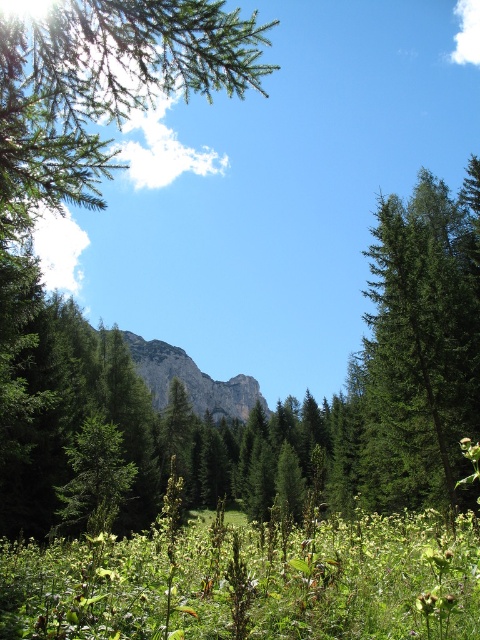
Does green needle-like branches at upper left appear under green matte tree at right?

Incorrect, green needle-like branches at upper left is not positioned below green matte tree at right.

Can you confirm if green needle-like branches at upper left is positioned to the left of green matte tree at right?

Indeed, green needle-like branches at upper left is positioned on the left side of green matte tree at right.

Is point (184, 64) less distant than point (465, 416)?

Yes, point (184, 64) is in front of point (465, 416).

I want to click on green needle-like branches at upper left, so click(103, 88).

Does green needle-like branches at upper left come behind rugged stone mountain at center?

No, it is not.

Between point (73, 60) and point (241, 404), which one is positioned behind?

Positioned behind is point (241, 404).

You are a GUI agent. You are given a task and a screenshot of the screen. Output one action in this format:
    pyautogui.click(x=<x>, y=<y>)
    Task: Click on the green needle-like branches at upper left
    
    Given the screenshot: What is the action you would take?
    pyautogui.click(x=103, y=88)

You are a GUI agent. You are given a task and a screenshot of the screen. Output one action in this format:
    pyautogui.click(x=<x>, y=<y>)
    Task: Click on the green needle-like branches at upper left
    This screenshot has height=640, width=480.
    Given the screenshot: What is the action you would take?
    pyautogui.click(x=103, y=88)

Who is higher up, green matte tree at right or rugged stone mountain at center?

green matte tree at right

Is point (419, 282) in front of point (141, 348)?

Yes.

Find the location of a particular element. This screenshot has height=640, width=480. green matte tree at right is located at coordinates (420, 342).